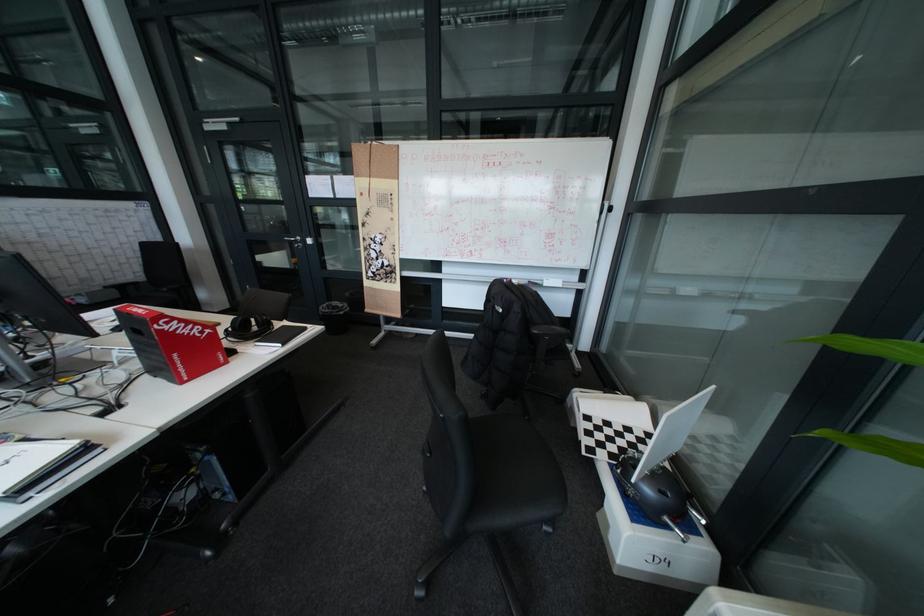
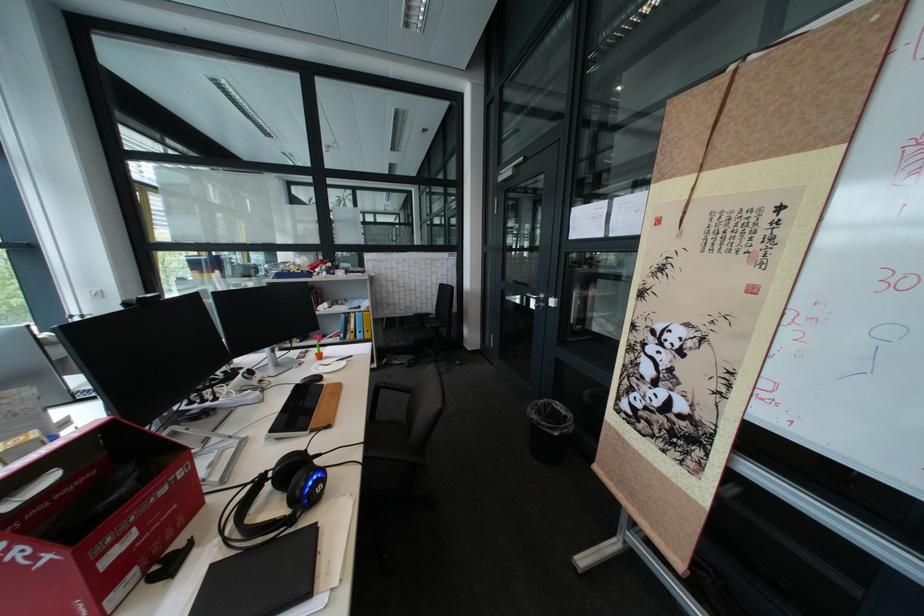
Locate, in the second image, the point that corresponds to [299,238] in the first image.

(541, 294)